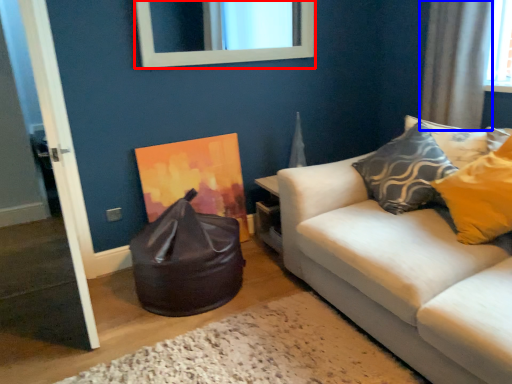
Question: Among these objects, which one is nearest to the camera, mirror (highlighted by a red box) or curtain (highlighted by a blue box)?

Choices:
 (A) mirror
 (B) curtain

Answer: (B)